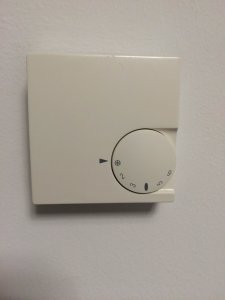
Locate an element on the screen. This screenshot has height=300, width=225. box is located at coordinates [85, 176].